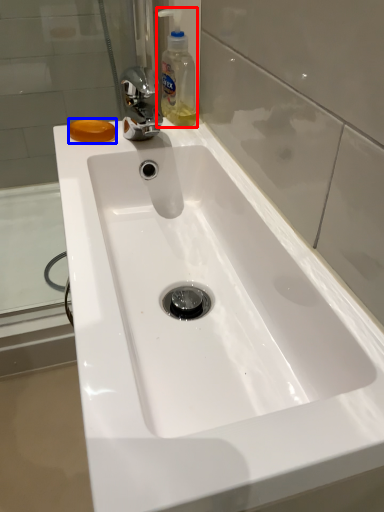
Question: Which object appears closest to the camera in this image, cleaning product (highlighted by a red box) or soap (highlighted by a blue box)?

Choices:
 (A) cleaning product
 (B) soap

Answer: (A)